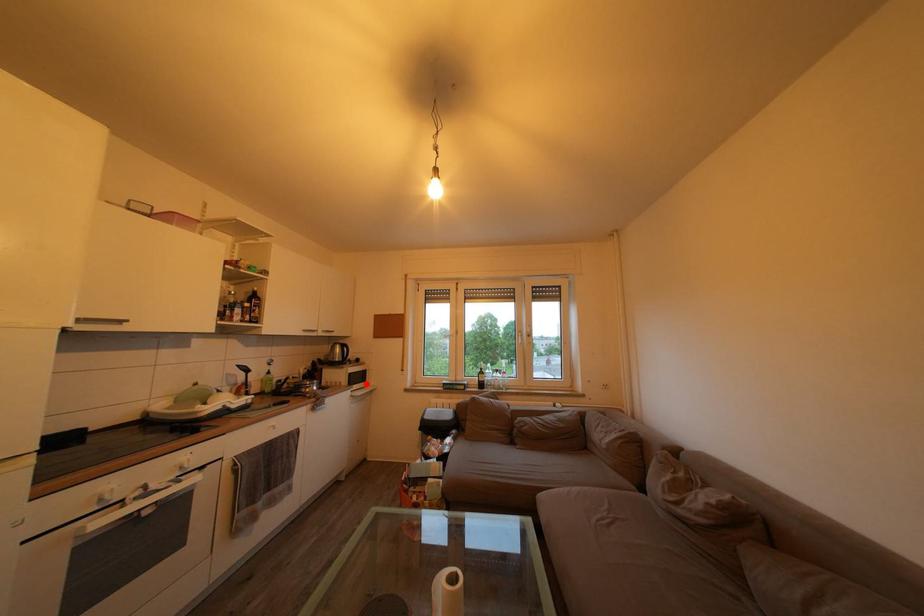
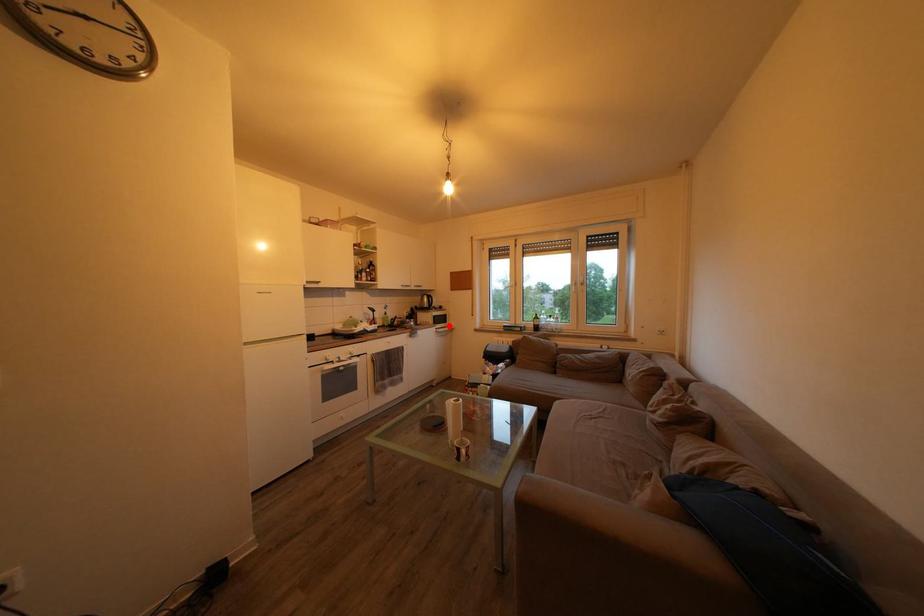
I am providing you with two images of the same scene from different viewpoints. A red point is marked on the first image and another point is marked on the second image. Does the point marked in image1 correspond to the same location as the one in image2?

Yes